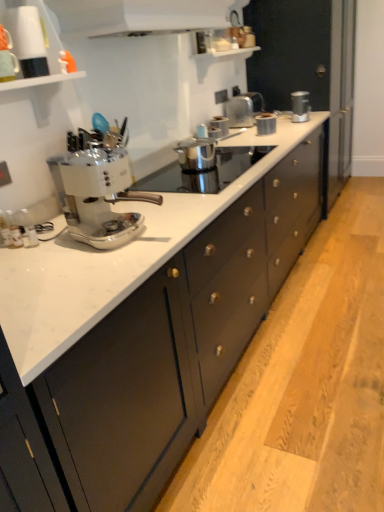
Question: From a real-world perspective, relative to white glossy range hood at upper center, is metallic silver toaster at center, the first appliance viewed from the left, vertically above or below?

Choices:
 (A) above
 (B) below

Answer: (B)

Question: Based on their positions, is metallic silver toaster at center, the 1th appliance from the front, located to the left or right of white glossy range hood at upper center?

Choices:
 (A) left
 (B) right

Answer: (B)

Question: Estimate the real-world distances between objects in this image. Which object is closer to the white glossy range hood at upper center?

Choices:
 (A) metallic silver toaster at upper center, which appears as the second kitchen appliance when viewed from the top
 (B) metallic silver toaster at upper right, marked as the 2th kitchen appliance in a front-to-back arrangement
 (C) metallic silver toaster at center, the first appliance viewed from the left
 (D) white glossy mug at upper left
 (E) matte black cabinets at center

Answer: (D)

Question: Which object is positioned closest to the metallic silver toaster at center, the 2th appliance viewed from the top?

Choices:
 (A) white glossy range hood at upper center
 (B) matte black cabinets at center
 (C) metallic silver toaster at upper right, the first kitchen appliance when ordered from right to left
 (D) white glossy mug at upper left
 (E) white glossy coffee maker at center

Answer: (C)